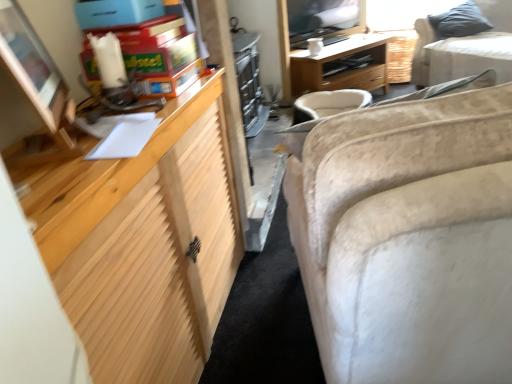
Question: Is matte wooden monitor at left next to beige fabric couch at right, positioned as the 1th studio couch in left-to-right order, and touching it?

Choices:
 (A) no
 (B) yes

Answer: (A)

Question: Does matte wooden monitor at left have a greater width compared to beige fabric couch at right, which ranks as the second studio couch in top-to-bottom order?

Choices:
 (A) no
 (B) yes

Answer: (A)

Question: From a real-world perspective, is matte wooden monitor at left physically below beige fabric couch at right, the 2th studio couch from the right?

Choices:
 (A) no
 (B) yes

Answer: (A)

Question: Could beige fabric couch at right, the 2th studio couch from the right, be considered to be inside matte wooden monitor at left?

Choices:
 (A) no
 (B) yes

Answer: (A)

Question: Is matte wooden monitor at left shorter than beige fabric couch at right, placed as the second studio couch when sorted from back to front?

Choices:
 (A) no
 (B) yes

Answer: (B)

Question: From a real-world perspective, is matte wooden monitor at left over beige fabric couch at right, the first studio couch positioned from the front?

Choices:
 (A) no
 (B) yes

Answer: (B)

Question: Does wooden desk at center have a larger size compared to matte cardboard toy at upper left?

Choices:
 (A) yes
 (B) no

Answer: (A)

Question: Are wooden desk at center and matte cardboard toy at upper left far apart?

Choices:
 (A) no
 (B) yes

Answer: (B)

Question: Can matte cardboard toy at upper left be found inside wooden desk at center?

Choices:
 (A) no
 (B) yes

Answer: (A)

Question: Is the depth of wooden desk at center greater than that of matte cardboard toy at upper left?

Choices:
 (A) yes
 (B) no

Answer: (A)

Question: Is wooden desk at center smaller than matte cardboard toy at upper left?

Choices:
 (A) no
 (B) yes

Answer: (A)

Question: Is wooden desk at center oriented away from matte cardboard toy at upper left?

Choices:
 (A) yes
 (B) no

Answer: (B)

Question: Is beige fabric couch at upper right, which is the second studio couch in left-to-right order, wider than gray fabric pillow at upper right?

Choices:
 (A) no
 (B) yes

Answer: (B)